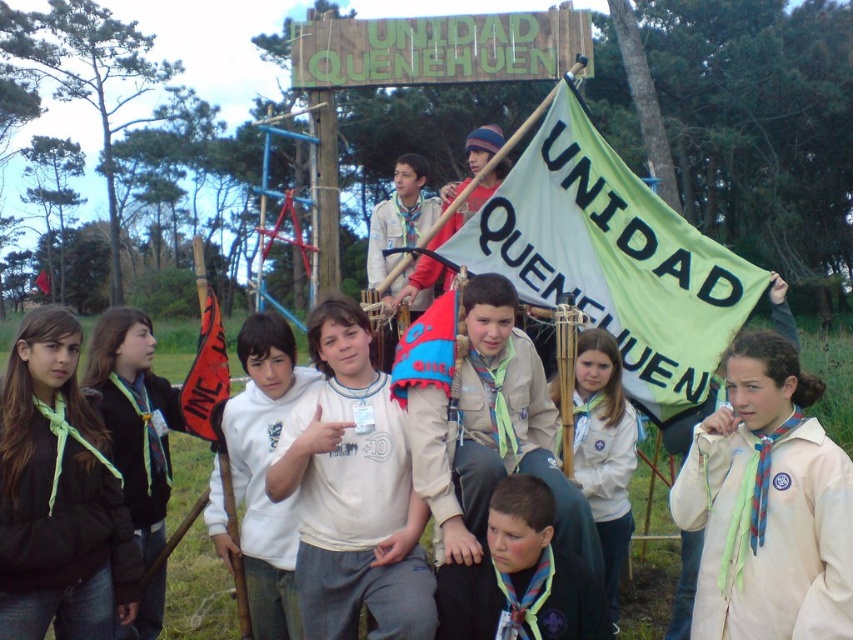
Does white matte jacket at center come in front of red fabric flag at left?

Yes, it is in front of red fabric flag at left.

Is white matte jacket at center thinner than red fabric flag at left?

Correct, white matte jacket at center's width is less than red fabric flag at left's.

Find the location of a particular element. The width and height of the screenshot is (853, 640). white matte jacket at center is located at coordinates (767, 506).

Is point (601, 480) positioned in front of point (202, 388)?

No, (601, 480) is behind (202, 388).

In the scene shown: Which is below, white fabric scarf at center or red fabric flag at left?

white fabric scarf at center

Which is in front, point (593, 371) or point (219, 380)?

Point (219, 380)

Identify the location of white fabric scarf at center. The image size is (853, 640). (604, 451).

Which is more to the right, white matte jacket at center or white fabric scarf at center?

white matte jacket at center is more to the right.

Is point (795, 492) behind point (619, 468)?

No.

Locate an element on the screen. The height and width of the screenshot is (640, 853). white matte jacket at center is located at coordinates (767, 506).